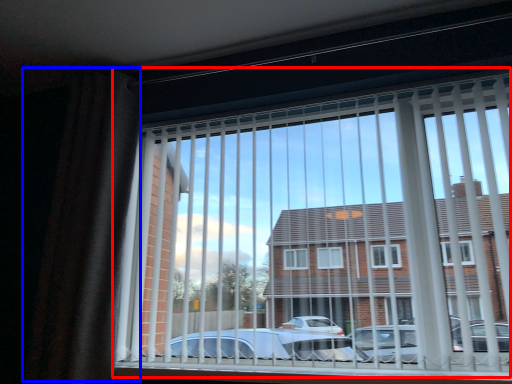
Question: Which object appears closest to the camera in this image, window (highlighted by a red box) or curtain (highlighted by a blue box)?

Choices:
 (A) window
 (B) curtain

Answer: (A)